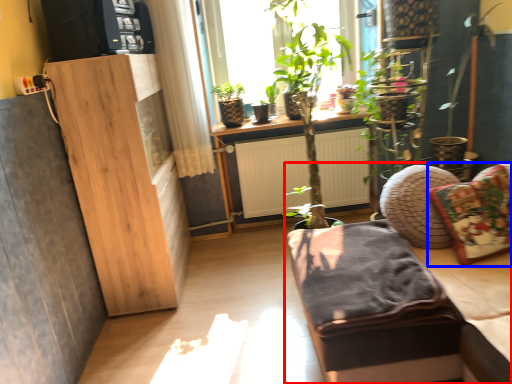
Question: Among these objects, which one is farthest to the camera, studio couch (highlighted by a red box) or pillow (highlighted by a blue box)?

Choices:
 (A) studio couch
 (B) pillow

Answer: (B)